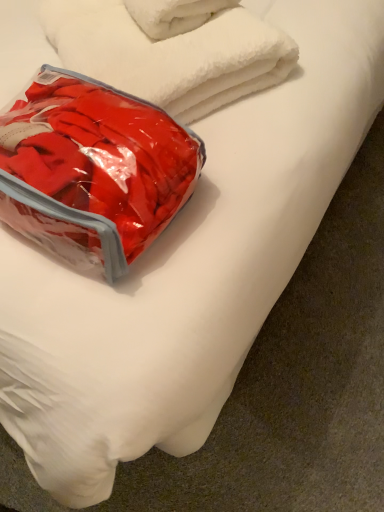
The image size is (384, 512). What do you see at coordinates (93, 169) in the screenshot? I see `transparent plastic bag at upper left` at bounding box center [93, 169].

Locate an element on the screen. This screenshot has height=512, width=384. transparent plastic bag at upper left is located at coordinates (93, 169).

What do you see at coordinates (170, 49) in the screenshot?
I see `white fluffy towel at upper center` at bounding box center [170, 49].

The width and height of the screenshot is (384, 512). Find the location of `white fluffy towel at upper center`. white fluffy towel at upper center is located at coordinates (170, 49).

In order to click on transparent plastic bag at upper left in this screenshot , I will do `click(93, 169)`.

Is white fluffy towel at upper center to the left or to the right of transparent plastic bag at upper left in the image?

white fluffy towel at upper center is to the right of transparent plastic bag at upper left.

Is white fluffy towel at upper center behind transparent plastic bag at upper left?

Yes, white fluffy towel at upper center is further from the viewer.

Is point (225, 36) more distant than point (114, 95)?

Yes, point (225, 36) is behind point (114, 95).

From the image's perspective, relative to transparent plastic bag at upper left, is white fluffy towel at upper center above or below?

white fluffy towel at upper center is situated higher than transparent plastic bag at upper left in the image.

From a real-world perspective, which is physically above, white fluffy towel at upper center or transparent plastic bag at upper left?

transparent plastic bag at upper left, from a real-world perspective.

Based on the photo, can you confirm if white fluffy towel at upper center is wider than transparent plastic bag at upper left?

Indeed, white fluffy towel at upper center has a greater width compared to transparent plastic bag at upper left.

Which of these two, white fluffy towel at upper center or transparent plastic bag at upper left, stands shorter?

With less height is transparent plastic bag at upper left.

Considering the sizes of white fluffy towel at upper center and transparent plastic bag at upper left in the image, is white fluffy towel at upper center bigger or smaller than transparent plastic bag at upper left?

white fluffy towel at upper center is bigger than transparent plastic bag at upper left.

Is white fluffy towel at upper center inside the boundaries of transparent plastic bag at upper left, or outside?

white fluffy towel at upper center is located beyond the bounds of transparent plastic bag at upper left.

Is white fluffy towel at upper center not close to transparent plastic bag at upper left?

No, there isn't a large distance between white fluffy towel at upper center and transparent plastic bag at upper left.

Is white fluffy towel at upper center oriented away from transparent plastic bag at upper left?

No, white fluffy towel at upper center's orientation is not away from transparent plastic bag at upper left.

How many degrees apart are the facing directions of white fluffy towel at upper center and transparent plastic bag at upper left?

26 degrees.

How distant is white fluffy towel at upper center from transparent plastic bag at upper left?

7.16 inches.

The image size is (384, 512). In order to click on towel behind the transparent plastic bag at upper left in this screenshot , I will do `click(170, 49)`.

Which object is positioned more to the right, transparent plastic bag at upper left or white fluffy towel at upper center?

From the viewer's perspective, white fluffy towel at upper center appears more on the right side.

Which object is closer to the camera, transparent plastic bag at upper left or white fluffy towel at upper center?

Positioned in front is transparent plastic bag at upper left.

Does point (69, 260) lie behind point (213, 65)?

No, (69, 260) is closer to viewer.

From the image's perspective, is transparent plastic bag at upper left located beneath white fluffy towel at upper center?

Correct, transparent plastic bag at upper left appears lower than white fluffy towel at upper center in the image.

From a real-world perspective, is transparent plastic bag at upper left physically below white fluffy towel at upper center?

No.

Based on the photo, does transparent plastic bag at upper left have a greater width compared to white fluffy towel at upper center?

Incorrect, the width of transparent plastic bag at upper left does not surpass that of white fluffy towel at upper center.

From their relative heights in the image, would you say transparent plastic bag at upper left is taller or shorter than white fluffy towel at upper center?

transparent plastic bag at upper left is shorter than white fluffy towel at upper center.

Looking at the image, does transparent plastic bag at upper left seem bigger or smaller compared to white fluffy towel at upper center?

transparent plastic bag at upper left is smaller than white fluffy towel at upper center.

Choose the correct answer: Is transparent plastic bag at upper left inside white fluffy towel at upper center or outside it?

transparent plastic bag at upper left exists outside the volume of white fluffy towel at upper center.

Is transparent plastic bag at upper left far away from white fluffy towel at upper center?

No, transparent plastic bag at upper left is not far away from white fluffy towel at upper center.

Is transparent plastic bag at upper left oriented towards white fluffy towel at upper center?

No, transparent plastic bag at upper left is not aimed at white fluffy towel at upper center.

How different are the orientations of transparent plastic bag at upper left and white fluffy towel at upper center in degrees?

transparent plastic bag at upper left and white fluffy towel at upper center are facing 26 degrees away from each other.

I want to click on pack above the white fluffy towel at upper center (from a real-world perspective), so click(93, 169).

The width and height of the screenshot is (384, 512). In order to click on pack above the white fluffy towel at upper center (from a real-world perspective) in this screenshot , I will do `click(93, 169)`.

At what (x,y) coordinates should I click in order to perform the action: click on towel below the transparent plastic bag at upper left (from a real-world perspective). Please return your answer as a coordinate pair (x, y). This screenshot has height=512, width=384. Looking at the image, I should click on [x=170, y=49].